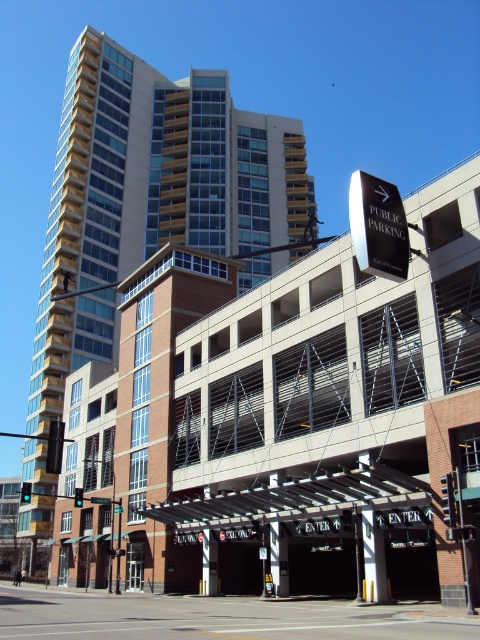
Question: Does concrete parking garage at center have a larger size compared to beige glass building at center?

Choices:
 (A) no
 (B) yes

Answer: (A)

Question: From the image, what is the correct spatial relationship of concrete parking garage at center in relation to beige glass building at center?

Choices:
 (A) below
 (B) above

Answer: (A)

Question: Is concrete parking garage at center positioned in front of beige glass building at center?

Choices:
 (A) yes
 (B) no

Answer: (A)

Question: Among these objects, which one is nearest to the camera?

Choices:
 (A) concrete parking garage at center
 (B) beige glass building at center

Answer: (A)